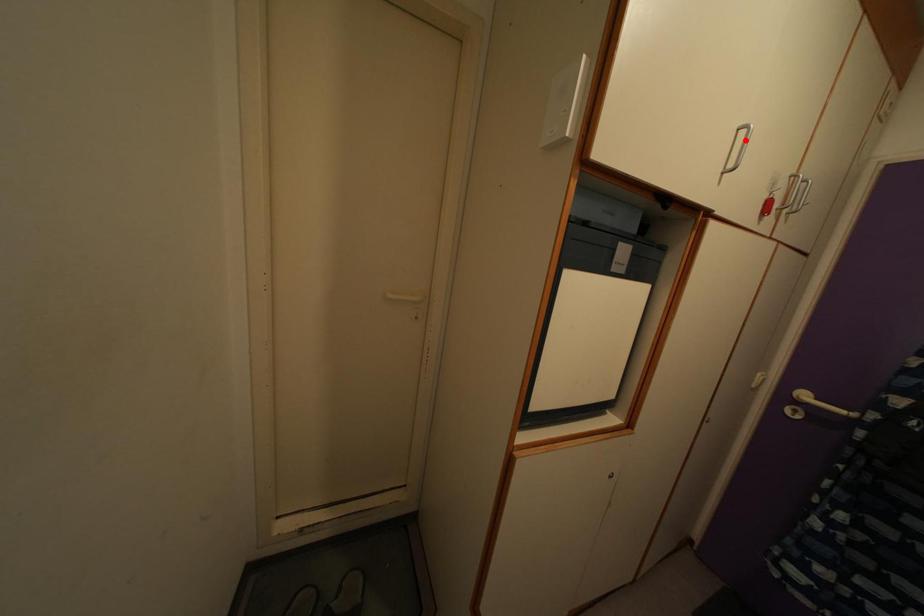
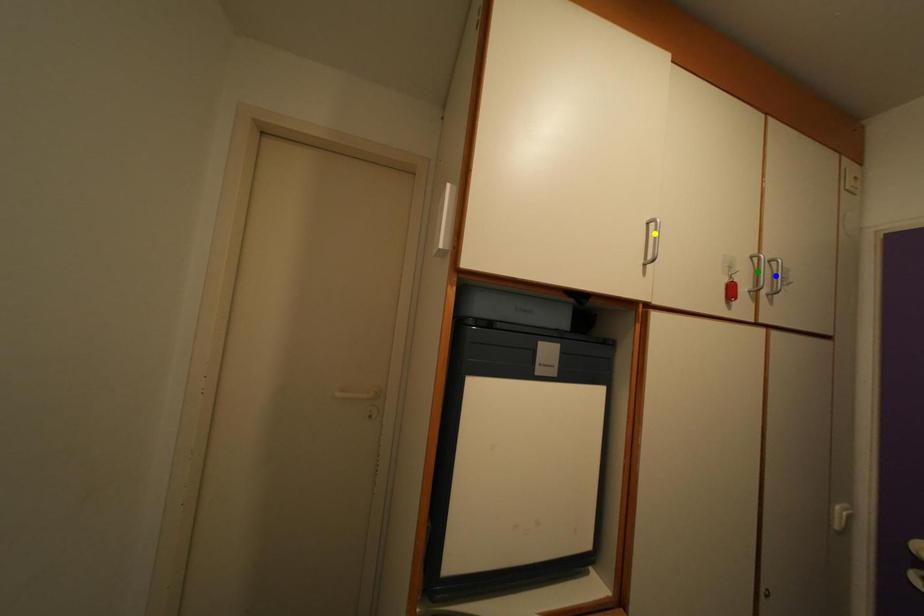
Question: I am providing you with two images of the same scene from different viewpoints. A red point is marked on the first image. You are given multiple points on the second image. In image 2, which mark is for the same physical point as the one in image 1?

Choices:
 (A) green point
 (B) yellow point
 (C) blue point

Answer: (B)